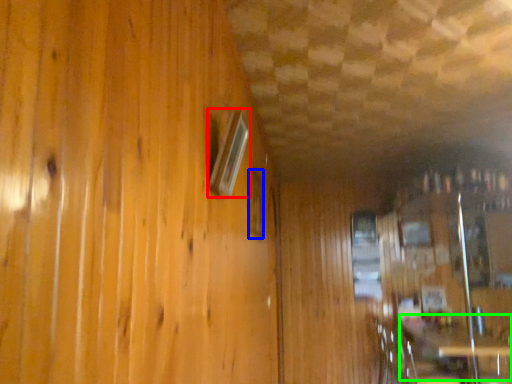
Question: Which is farther away from window (highlighted by a red box)? window (highlighted by a blue box) or table (highlighted by a green box)?

Choices:
 (A) window
 (B) table

Answer: (B)